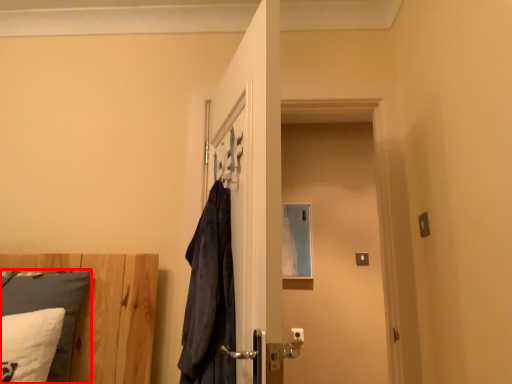
Question: From the image's perspective, what is the correct spatial positioning of pillow (annotated by the red box) in reference to screen door?

Choices:
 (A) below
 (B) above

Answer: (A)